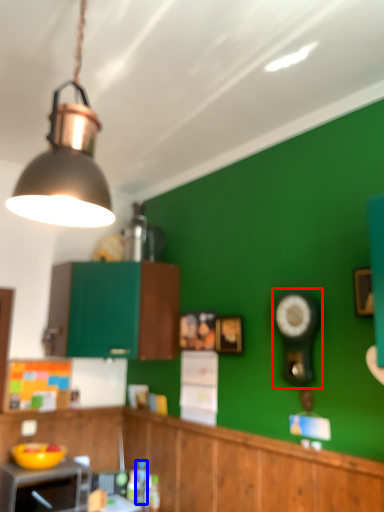
Question: Which object is further to the camera taking this photo, clock (highlighted by a red box) or bottle (highlighted by a blue box)?

Choices:
 (A) clock
 (B) bottle

Answer: (B)